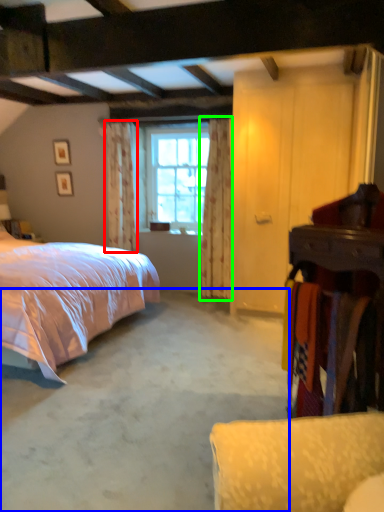
Question: Considering the real-world distances, which object is farthest from curtain (highlighted by a red box)? concrete (highlighted by a blue box) or curtain (highlighted by a green box)?

Choices:
 (A) concrete
 (B) curtain

Answer: (A)